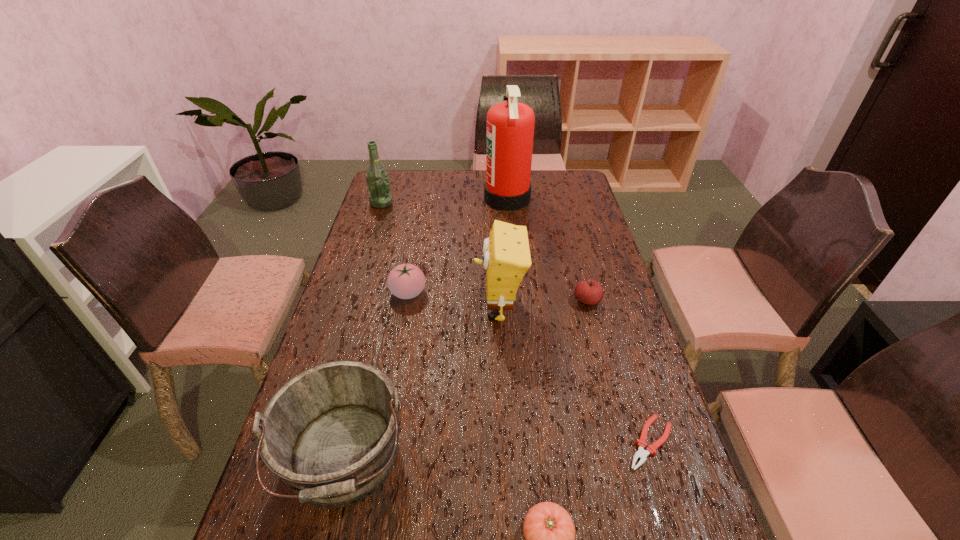
The image size is (960, 540). I want to click on the tallest object, so click(x=510, y=125).

The image size is (960, 540). What are the coordinates of `sponge` in the screenshot? It's located at (506, 259).

Locate an element on the screen. The height and width of the screenshot is (540, 960). beer bottle is located at coordinates (378, 185).

The image size is (960, 540). I want to click on the fifth shortest object, so click(x=330, y=433).

The width and height of the screenshot is (960, 540). What are the coordinates of `the tallest tomato` in the screenshot? It's located at (406, 281).

Identify the location of the fifth tallest object. pos(406,281).

You are a GUI agent. You are given a task and a screenshot of the screen. Output one action in this format:
    pyautogui.click(x=<x>, y=<y>)
    Task: Click on the rightmost tomato
    The height and width of the screenshot is (540, 960).
    Given the screenshot: What is the action you would take?
    pyautogui.click(x=589, y=292)

The height and width of the screenshot is (540, 960). In order to click on pliers in this screenshot , I will do [651, 449].

Where is `free spot located at the nozzle of the tallest object`? free spot located at the nozzle of the tallest object is located at coordinates (469, 199).

Locate an element on the screen. Image resolution: width=960 pixels, height=540 pixels. vacant space located at the nozzle of the tallest object is located at coordinates (460, 199).